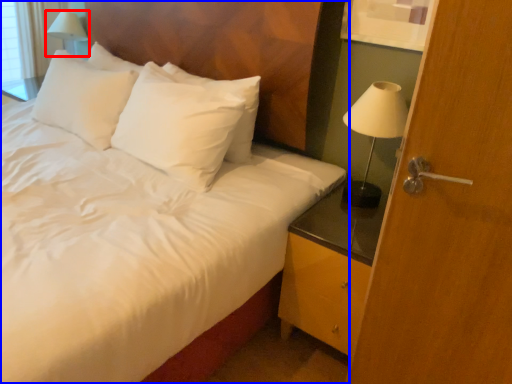
Question: Which object is further to the camera taking this photo, table lamp (highlighted by a red box) or bed (highlighted by a blue box)?

Choices:
 (A) table lamp
 (B) bed

Answer: (A)